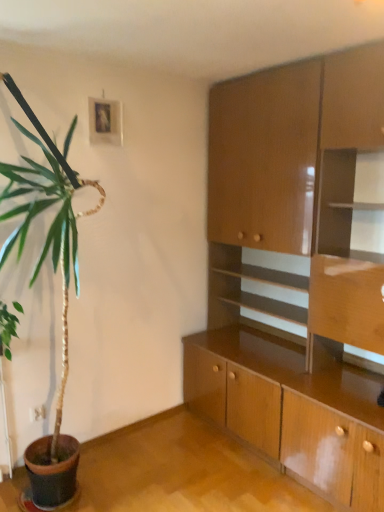
Find the location of a particular element. Image resolution: width=384 pixels, height=512 pixels. wooden cabinet at right is located at coordinates (296, 272).

The height and width of the screenshot is (512, 384). What do you see at coordinates (296, 272) in the screenshot?
I see `wooden cabinet at right` at bounding box center [296, 272].

At what (x,y) coordinates should I click in order to perform the action: click on wooden cabinet at right. Please return your answer as a coordinate pair (x, y). The width and height of the screenshot is (384, 512). Looking at the image, I should click on pyautogui.click(x=296, y=272).